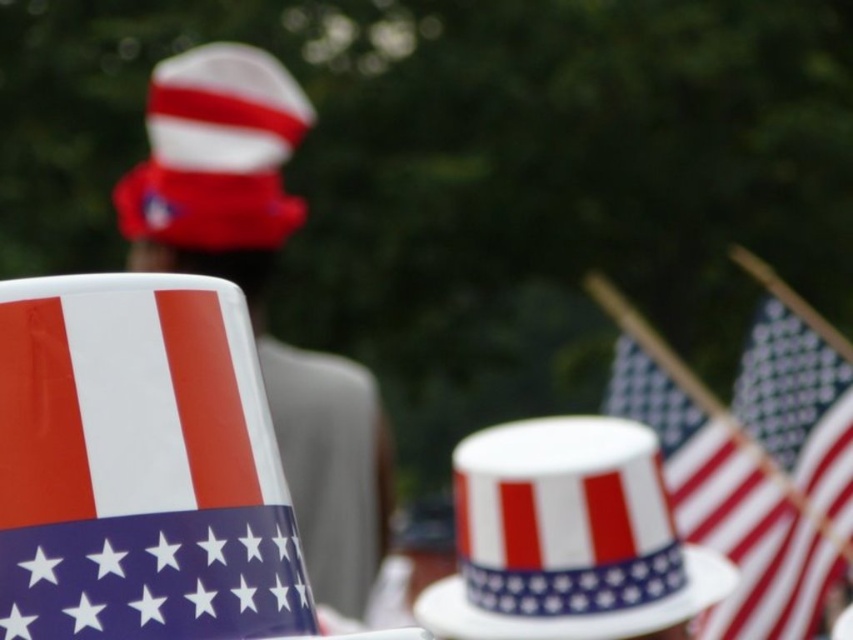
Question: Where is red and white striped hat at upper left located in relation to polka dot fabric flag at center in the image?

Choices:
 (A) left
 (B) right

Answer: (A)

Question: Estimate the real-world distances between objects in this image. Which object is farther from the porcelain cup with american flag design at left?

Choices:
 (A) polka dot fabric flag at center
 (B) american flag at right

Answer: (A)

Question: Which of the following is the closest to the observer?

Choices:
 (A) tap(134, 208)
 (B) tap(706, 433)

Answer: (B)

Question: Which object is farther from the camera taking this photo?

Choices:
 (A) polka dot fabric flag at center
 (B) red and white striped hat at upper left
 (C) matte white hat with red, white, and blue stripes at center

Answer: (B)

Question: Is porcelain cup with american flag design at left thinner than polka dot fabric flag at center?

Choices:
 (A) yes
 (B) no

Answer: (A)

Question: In this image, where is porcelain cup with american flag design at left located relative to matte white hat with red, white, and blue stripes at center?

Choices:
 (A) above
 (B) below

Answer: (A)